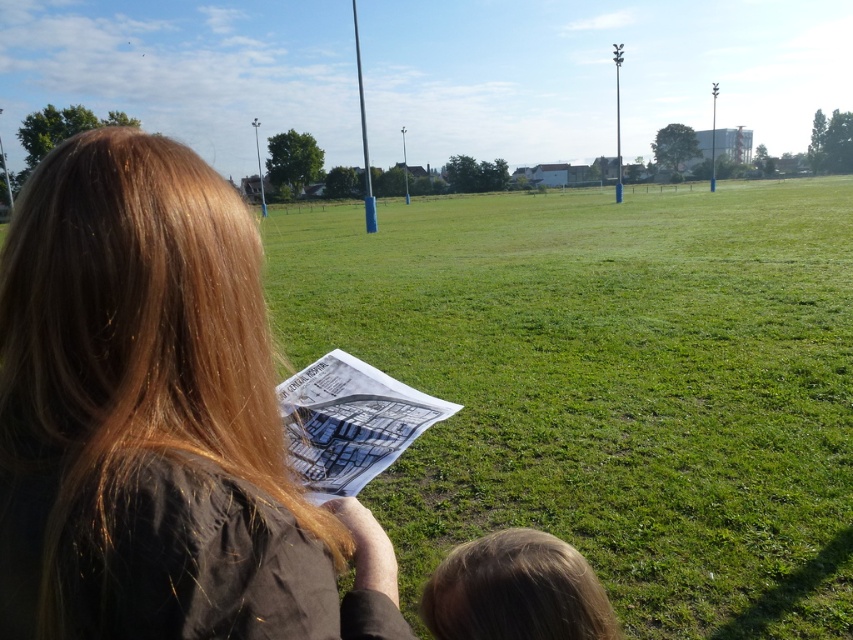
Question: Is green grass field at center wider than brown hair at left?

Choices:
 (A) no
 (B) yes

Answer: (B)

Question: Is green grass field at center to the left of brown hair at left from the viewer's perspective?

Choices:
 (A) no
 (B) yes

Answer: (A)

Question: Is green grass field at center bigger than brown hair at left?

Choices:
 (A) yes
 (B) no

Answer: (A)

Question: Estimate the real-world distances between objects in this image. Which object is closer to the brown hair at left?

Choices:
 (A) green grass field at center
 (B) blonde hair at lower center

Answer: (B)

Question: Which object is closer to the camera taking this photo?

Choices:
 (A) brown hair at left
 (B) blonde hair at lower center
 (C) green grass field at center

Answer: (A)

Question: Estimate the real-world distances between objects in this image. Which object is closer to the brown hair at left?

Choices:
 (A) blonde hair at lower center
 (B) green grass field at center

Answer: (A)